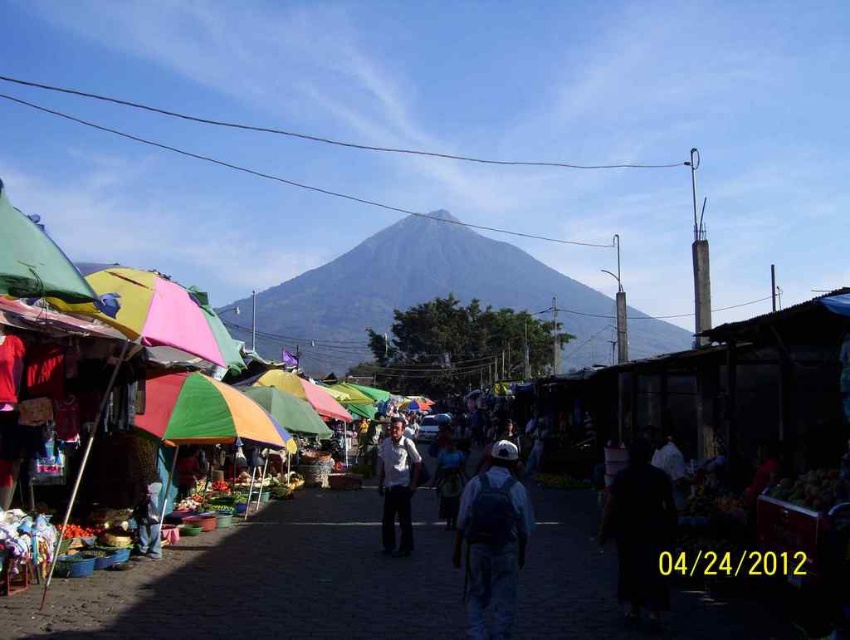
Question: Is gray matte mountain at center bigger than green fabric canopy at left?

Choices:
 (A) no
 (B) yes

Answer: (B)

Question: Which object is the closest to the green fabric canopy at left?

Choices:
 (A) black matte person at center
 (B) white cotton shirt at center

Answer: (A)

Question: Can you confirm if green fabric canopy at left is positioned above blue denim jeans at lower left?

Choices:
 (A) yes
 (B) no

Answer: (A)

Question: Which point appears closest to the camera in this image?

Choices:
 (A) (34, 296)
 (B) (516, 476)
 (C) (151, 509)

Answer: (A)

Question: Estimate the real-world distances between objects in this image. Which object is closer to the dark gray backpack at center?

Choices:
 (A) white cotton shirt at center
 (B) gray matte mountain at center

Answer: (A)

Question: Does gray matte mountain at center appear on the left side of dark gray backpack at center?

Choices:
 (A) no
 (B) yes

Answer: (A)